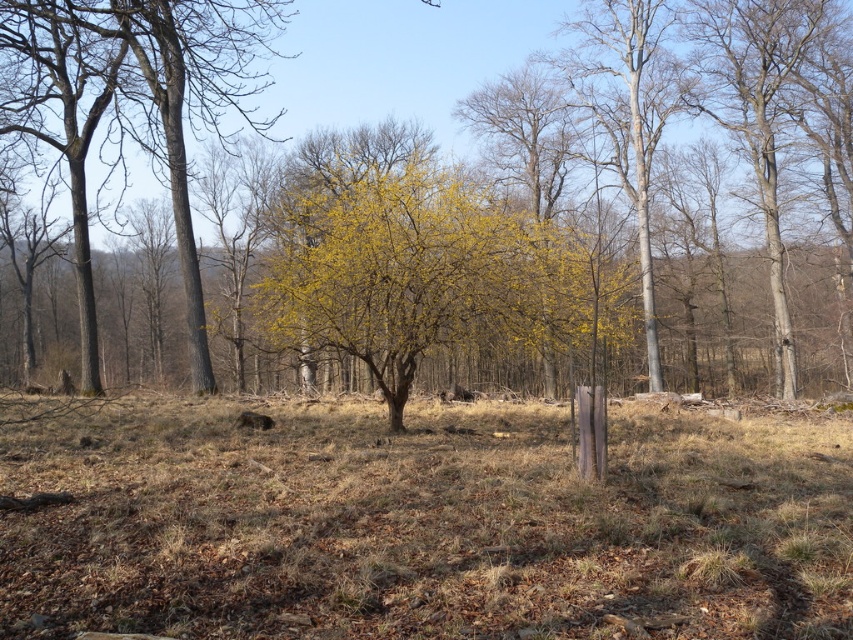
Question: Which point is farther from the camera taking this photo?

Choices:
 (A) (416, 150)
 (B) (62, 97)
 (C) (761, 10)

Answer: (A)

Question: Does yellow leafy tree at center appear over bare wood at right?

Choices:
 (A) no
 (B) yes

Answer: (B)

Question: In this image, where is yellow leafy tree at center located relative to yellow-green foliage at center?

Choices:
 (A) left
 (B) right

Answer: (A)

Question: Which point is closer to the camera?

Choices:
 (A) (412, 148)
 (B) (347, 292)

Answer: (B)

Question: Which of these objects is positioned farthest from the bare wood at right?

Choices:
 (A) smooth bark tree at left
 (B) yellow leafy tree at center

Answer: (A)

Question: In this image, where is smooth bark tree at left located relative to bare wood at right?

Choices:
 (A) below
 (B) above

Answer: (B)